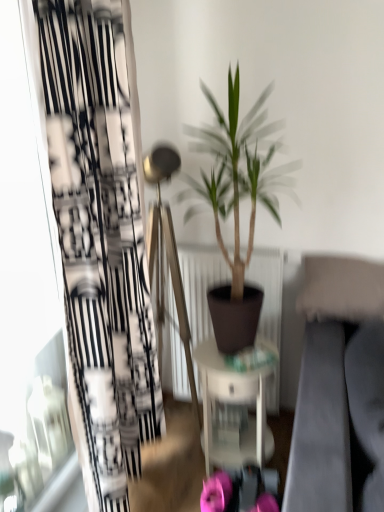
Question: Is white glossy table at center in front of or behind green matte plant at center in the image?

Choices:
 (A) front
 (B) behind

Answer: (B)

Question: In terms of size, does white glossy table at center appear bigger or smaller than green matte plant at center?

Choices:
 (A) small
 (B) big

Answer: (A)

Question: Based on their relative distances, which object is nearer to the pink fabric flower at lower center, the 2th flower positioned from the right?

Choices:
 (A) white glossy table at center
 (B) black printed fabric curtain at left
 (C) pink fabric flower at lower center, the second flower viewed from the left
 (D) green matte plant at center

Answer: (C)

Question: Considering the real-world distances, which object is closest to the green matte plant at center?

Choices:
 (A) pink fabric flower at lower center, the first flower viewed from the left
 (B) pink fabric flower at lower center, which is counted as the 1th flower, starting from the right
 (C) black printed fabric curtain at left
 (D) white glossy table at center

Answer: (D)